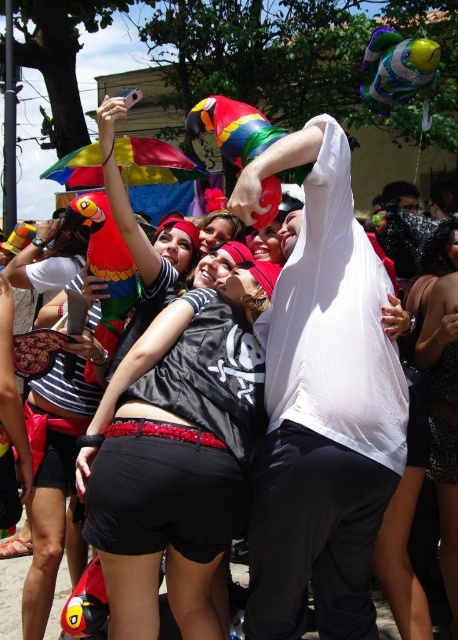
Is white matte shirt at center smaller than black sequined shorts at lower center?

Actually, white matte shirt at center might be larger than black sequined shorts at lower center.

Between white matte shirt at center and black sequined shorts at lower center, which one has less height?

Standing shorter between the two is black sequined shorts at lower center.

Does point (304, 500) lie behind point (456, 243)?

No, (304, 500) is closer to viewer.

Where is `white matte shirt at center`? white matte shirt at center is located at coordinates (321, 403).

Looking at this image, is white matte shirt at center to the left of black satin dress at lower right from the viewer's perspective?

Yes, white matte shirt at center is to the left of black satin dress at lower right.

Find the location of `white matte shirt at center`. white matte shirt at center is located at coordinates (321, 403).

Is point (375, 305) farther from camera compared to point (442, 285)?

No.

At what (x,y) coordinates should I click in order to perform the action: click on white matte shirt at center. Please return your answer as a coordinate pair (x, y). This screenshot has height=640, width=458. Looking at the image, I should click on [x=321, y=403].

Does black sequined shorts at lower center have a larger size compared to matte black shirt at center?

Correct, black sequined shorts at lower center is larger in size than matte black shirt at center.

Is point (426, 301) closer to viewer compared to point (243, 236)?

Yes, it is.

The image size is (458, 640). Identify the location of black sequined shorts at lower center. (425, 440).